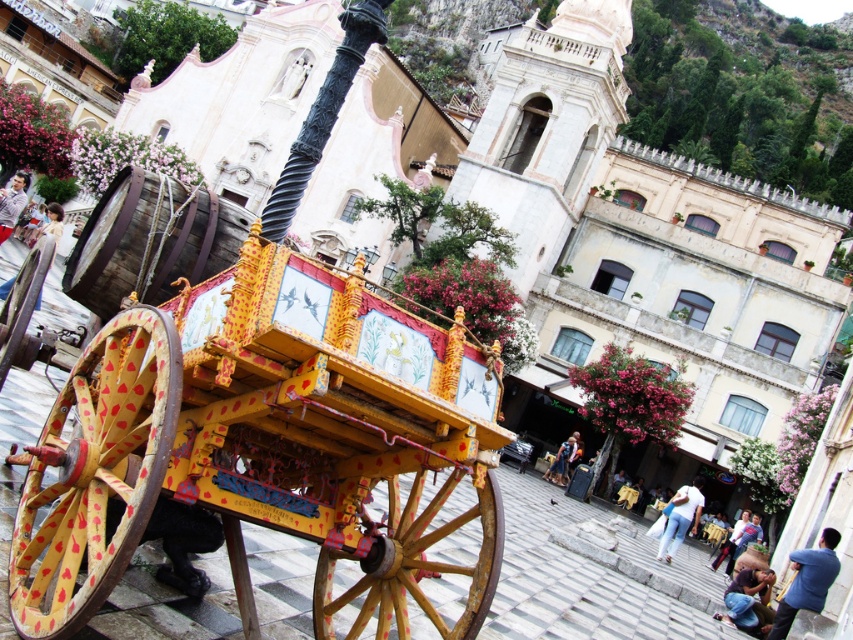
Question: Can you confirm if wooden painted cartwheel at lower left is bigger than light brown leather jacket at center?

Choices:
 (A) yes
 (B) no

Answer: (B)

Question: Is yellow painted wood wheel at lower left positioned behind blue cotton shirt at lower right?

Choices:
 (A) yes
 (B) no

Answer: (B)

Question: Which object is positioned closest to the yellow painted wood wheel at lower left?

Choices:
 (A) denim jacket at lower right
 (B) wooden painted cartwheel at lower left

Answer: (B)

Question: Which point appears closest to the camera in this image?

Choices:
 (A) (740, 621)
 (B) (15, 333)
 (C) (824, 556)

Answer: (B)

Question: Considering the real-world distances, which object is farthest from the wooden painted cartwheel at lower left?

Choices:
 (A) yellow painted wood wheel at lower left
 (B) blue jeans at lower right

Answer: (B)

Question: Where is wooden cart at center located in relation to yellow painted wood wheel at lower left in the image?

Choices:
 (A) right
 (B) left

Answer: (A)